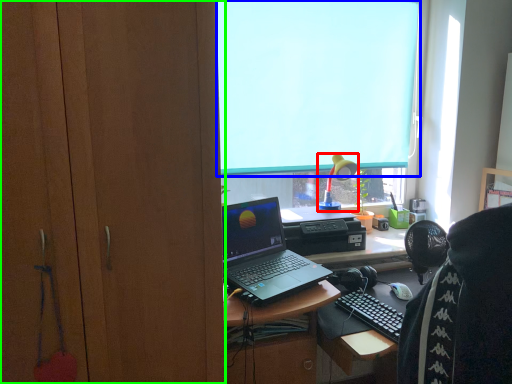
Question: Considering the real-world distances, which object is farthest from lamp (highlighted by a red box)? window screen (highlighted by a blue box) or cabinetry (highlighted by a green box)?

Choices:
 (A) window screen
 (B) cabinetry

Answer: (B)